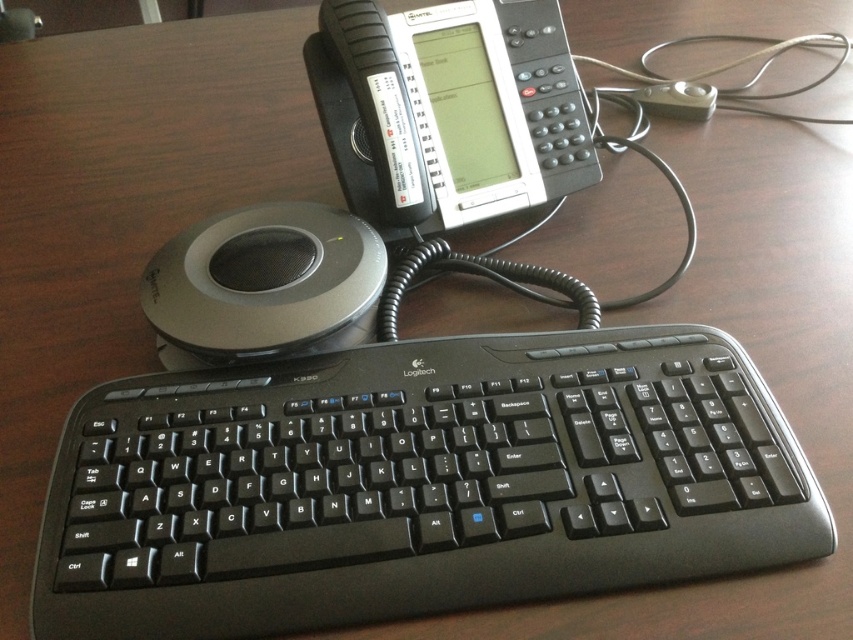
Question: Estimate the real-world distances between objects in this image. Which object is farther from the black plastic phone at upper center?

Choices:
 (A) black plastic keyboard at center
 (B) silver/metallic speaker at left

Answer: (A)

Question: Is black plastic keyboard at center above black plastic phone at upper center?

Choices:
 (A) yes
 (B) no

Answer: (B)

Question: Observing the image, what is the correct spatial positioning of black plastic phone at upper center in reference to silver/metallic speaker at left?

Choices:
 (A) left
 (B) right

Answer: (B)

Question: Which object is farther from the camera taking this photo?

Choices:
 (A) black plastic keyboard at center
 (B) silver/metallic speaker at left

Answer: (B)

Question: Does black plastic phone at upper center come behind silver/metallic speaker at left?

Choices:
 (A) no
 (B) yes

Answer: (B)

Question: Among these points, which one is nearest to the camera?

Choices:
 (A) (309, 234)
 (B) (566, 518)
 (C) (352, 99)

Answer: (B)